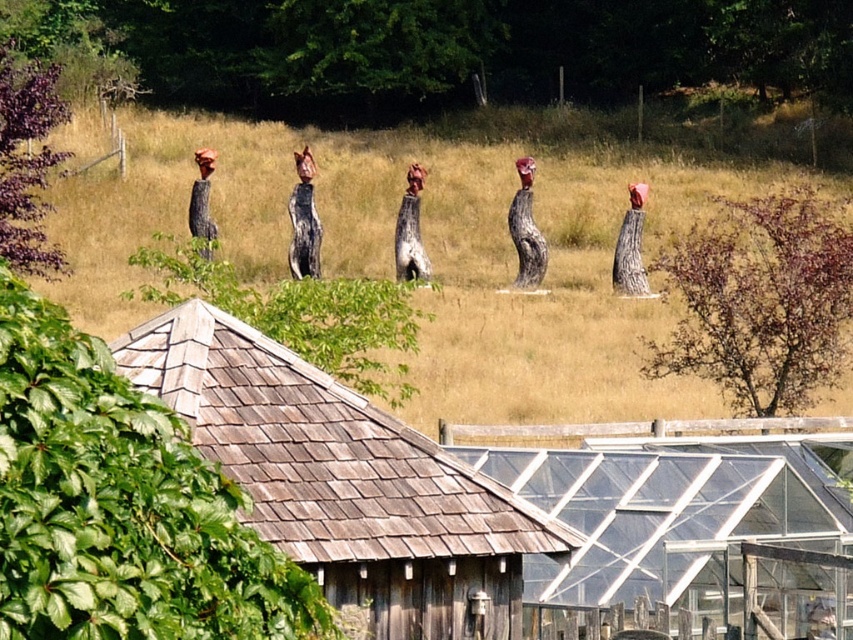
Question: Which object is the closest to the wooden hut at center?

Choices:
 (A) brown grass at center
 (B) wooden shingles at center

Answer: (B)

Question: Which point is closer to the camera taking this photo?

Choices:
 (A) (312, 374)
 (B) (605, 604)
 (C) (244, 147)

Answer: (A)

Question: Which point is closer to the camera taking this photo?

Choices:
 (A) (164, 312)
 (B) (260, 157)
 (C) (750, 461)

Answer: (A)

Question: Can you confirm if brown grass at center is thinner than wooden shingles at center?

Choices:
 (A) no
 (B) yes

Answer: (A)

Question: Is brown grass at center above wooden hut at center?

Choices:
 (A) no
 (B) yes

Answer: (B)

Question: Is brown grass at center below wooden shingles at center?

Choices:
 (A) no
 (B) yes

Answer: (A)